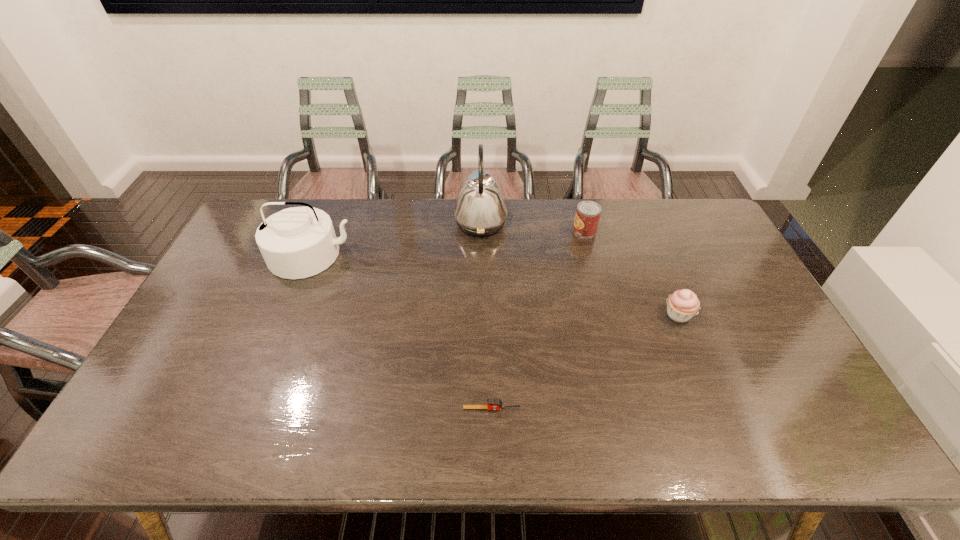
Identify the location of free space that satisfies the following two spatial constraints: 1. from the spout of the cupcake; 2. on the left side of the right kettle. The width and height of the screenshot is (960, 540). point(481,315).

I want to click on vacant space that satisfies the following two spatial constraints: 1. from the spout of the fourth farthest object; 2. on the right side of the taller kettle, so click(481, 315).

Find the location of a particular element. The height and width of the screenshot is (540, 960). vacant space that satisfies the following two spatial constraints: 1. on the spout of the shorter kettle; 2. on the right side of the nearest object is located at coordinates (252, 408).